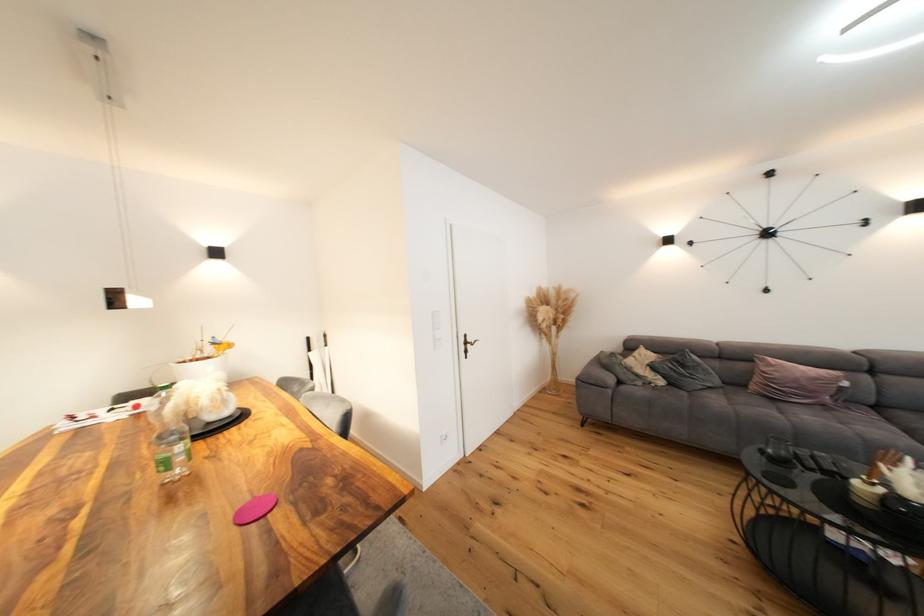
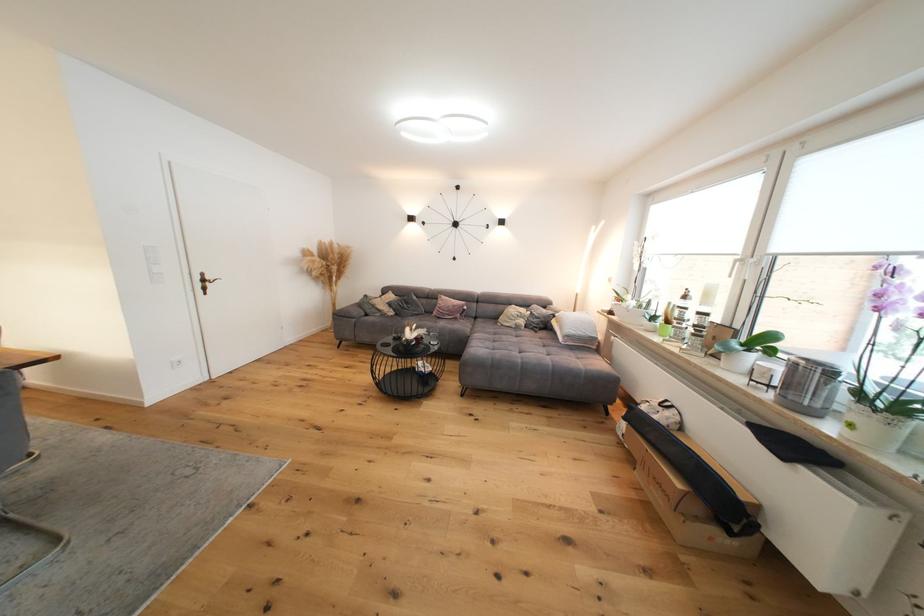
Locate, in the second image, the point that corresponds to [763,381] in the first image.

(444, 310)